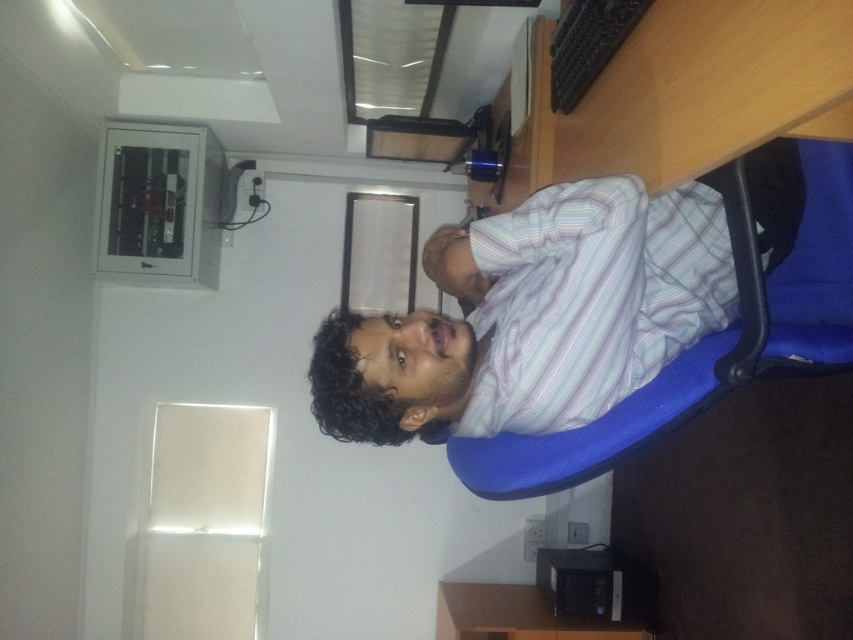
You are a delivery person trying to place a small package on the desk. The package must be placed in front of the white striped shirt at center and behind the black plastic computer at lower center. Is this possible given their positions?

The white striped shirt at center is closer to the viewer than the black plastic computer at lower center. Therefore, placing the package in front of the white striped shirt at center and behind the black plastic computer at lower center is not possible because the shirt is already in front of the computer.

You are a delivery robot trying to reach a package located at point (682, 282). Your maximum reach distance is 1.5 meters. Can you reach the package?

The distance between the camera and point (682, 282) is 1.38 meters, so yes, the delivery robot can reach the package since it is within the maximum reach distance of 1.5 meters.